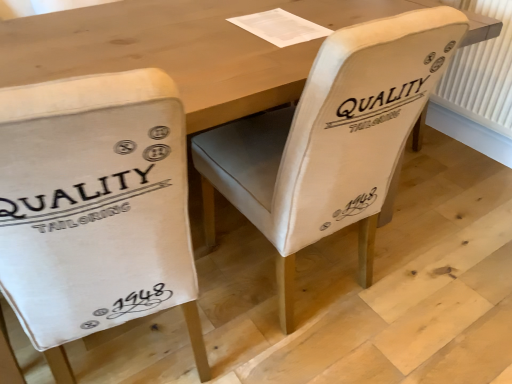
Question: From their relative heights in the image, would you say white plastic radiator at right is taller or shorter than white canvas chair at left, which ranks as the 2th chair in right-to-left order?

Choices:
 (A) tall
 (B) short

Answer: (B)

Question: From a real-world perspective, is white plastic radiator at right above or below white canvas chair at left, acting as the first chair starting from the left?

Choices:
 (A) below
 (B) above

Answer: (A)

Question: Considering the real-world distances, which object is farthest from the white fabric chair at center, which appears as the first chair when viewed from the right?

Choices:
 (A) white plastic radiator at right
 (B) white canvas chair at left, acting as the first chair starting from the left

Answer: (A)

Question: Which object is the closest to the white canvas chair at left, which ranks as the 2th chair in right-to-left order?

Choices:
 (A) white plastic radiator at right
 (B) white fabric chair at center, which appears as the first chair when viewed from the right

Answer: (B)